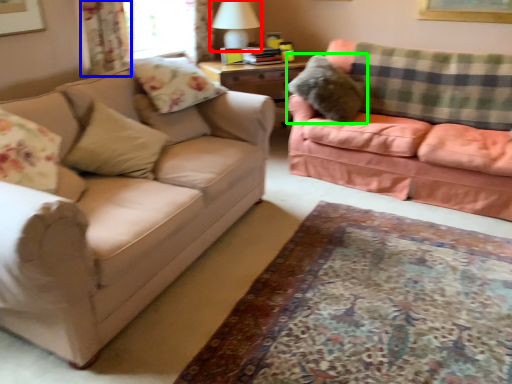
Question: Based on their relative distances, which object is nearer to table lamp (highlighted by a red box)? Choose from curtain (highlighted by a blue box) and pillow (highlighted by a green box).

Choices:
 (A) curtain
 (B) pillow

Answer: (B)